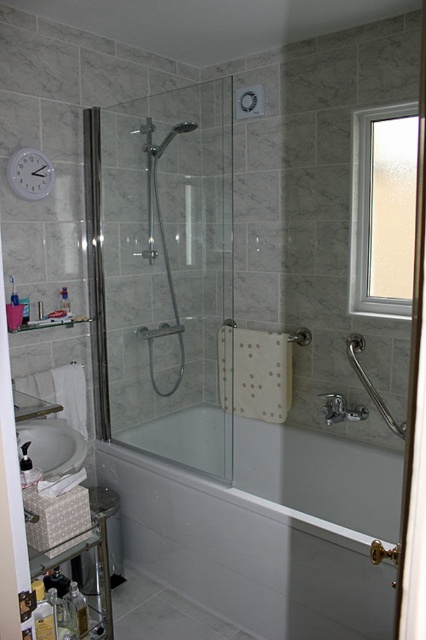
Question: Which of these objects is positioned farthest from the white glossy bathtub at center?

Choices:
 (A) clear glass shower door at center
 (B) clear glass screen door at right
 (C) white glossy sink at lower left

Answer: (B)

Question: Can you confirm if clear glass shower door at center is wider than white glossy sink at lower left?

Choices:
 (A) no
 (B) yes

Answer: (B)

Question: Among these objects, which one is nearest to the camera?

Choices:
 (A) white glossy bathtub at center
 (B) clear glass shower door at center
 (C) white glossy sink at lower left
 (D) clear glass screen door at right

Answer: (D)

Question: Is clear glass screen door at right in front of white glossy sink at lower left?

Choices:
 (A) no
 (B) yes

Answer: (B)

Question: Which of the following is the closest to the observer?

Choices:
 (A) clear glass shower door at center
 (B) clear glass screen door at right

Answer: (B)

Question: Can you confirm if clear glass shower door at center is bigger than white glossy bathtub at center?

Choices:
 (A) yes
 (B) no

Answer: (A)